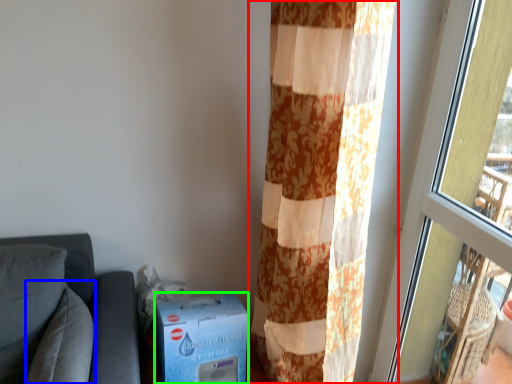
Question: Based on their relative distances, which object is farther from curtain (highlighted by a red box)? Choose from pillow (highlighted by a blue box) and cardboard box (highlighted by a green box).

Choices:
 (A) pillow
 (B) cardboard box

Answer: (A)